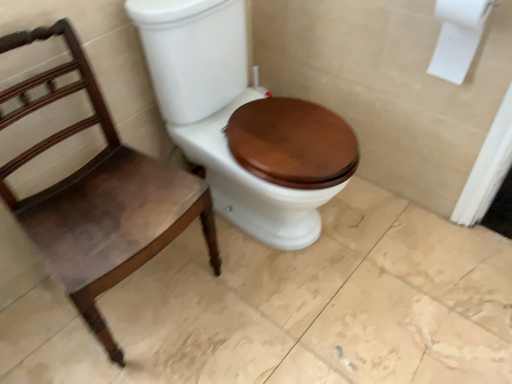
Question: Is matte brown wood toilet seat at center shorter than white paper at upper right?

Choices:
 (A) no
 (B) yes

Answer: (A)

Question: From a real-world perspective, is matte brown wood toilet seat at center under white paper at upper right?

Choices:
 (A) no
 (B) yes

Answer: (B)

Question: From the image's perspective, is matte brown wood toilet seat at center located above white paper at upper right?

Choices:
 (A) no
 (B) yes

Answer: (A)

Question: Is matte brown wood toilet seat at center aimed at white paper at upper right?

Choices:
 (A) no
 (B) yes

Answer: (A)

Question: Can white paper at upper right be found inside matte brown wood toilet seat at center?

Choices:
 (A) yes
 (B) no

Answer: (B)

Question: Is white paper at upper right taller or shorter than mahogany wood chair at left?

Choices:
 (A) short
 (B) tall

Answer: (A)

Question: Looking at their shapes, would you say white paper at upper right is wider or thinner than mahogany wood chair at left?

Choices:
 (A) wide
 (B) thin

Answer: (B)

Question: From the image's perspective, relative to mahogany wood chair at left, is white paper at upper right above or below?

Choices:
 (A) below
 (B) above

Answer: (B)

Question: Is white paper at upper right inside the boundaries of mahogany wood chair at left, or outside?

Choices:
 (A) inside
 (B) outside

Answer: (B)

Question: From a real-world perspective, is mahogany wood chair at left physically located above or below matte brown wood toilet seat at center?

Choices:
 (A) above
 (B) below

Answer: (B)

Question: In terms of width, does mahogany wood chair at left look wider or thinner when compared to matte brown wood toilet seat at center?

Choices:
 (A) wide
 (B) thin

Answer: (B)

Question: Is mahogany wood chair at left bigger or smaller than matte brown wood toilet seat at center?

Choices:
 (A) small
 (B) big

Answer: (A)

Question: Is mahogany wood chair at left inside the boundaries of matte brown wood toilet seat at center, or outside?

Choices:
 (A) outside
 (B) inside

Answer: (A)

Question: From the image's perspective, is white paper at upper right positioned above or below matte brown wood toilet seat at center?

Choices:
 (A) above
 (B) below

Answer: (A)

Question: From a real-world perspective, is white paper at upper right positioned above or below matte brown wood toilet seat at center?

Choices:
 (A) above
 (B) below

Answer: (A)